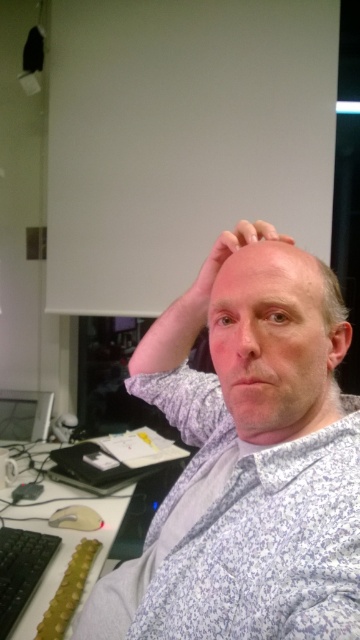
From the picture: Is white printed shirt at center shorter than smooth bald head at upper center?

No, white printed shirt at center is not shorter than smooth bald head at upper center.

Can you confirm if white printed shirt at center is thinner than smooth bald head at upper center?

In fact, white printed shirt at center might be wider than smooth bald head at upper center.

Locate an element on the screen. white printed shirt at center is located at coordinates (246, 460).

From the picture: Does smooth bald head at upper center appear on the right side of matte black monitor at lower left?

Correct, you'll find smooth bald head at upper center to the right of matte black monitor at lower left.

Is point (304, 266) less distant than point (6, 432)?

Yes.

I want to click on smooth bald head at upper center, so click(270, 275).

Does white printed shirt at center appear on the left side of black plastic computer desk at lower left?

No, white printed shirt at center is not to the left of black plastic computer desk at lower left.

Does white printed shirt at center lie in front of black plastic computer desk at lower left?

Yes, white printed shirt at center is closer to the viewer.

Is point (186, 625) closer to viewer compared to point (20, 630)?

Yes, it is in front of point (20, 630).

At what (x,y) coordinates should I click in order to perform the action: click on white printed shirt at center. Please return your answer as a coordinate pair (x, y). Looking at the image, I should click on (246, 460).